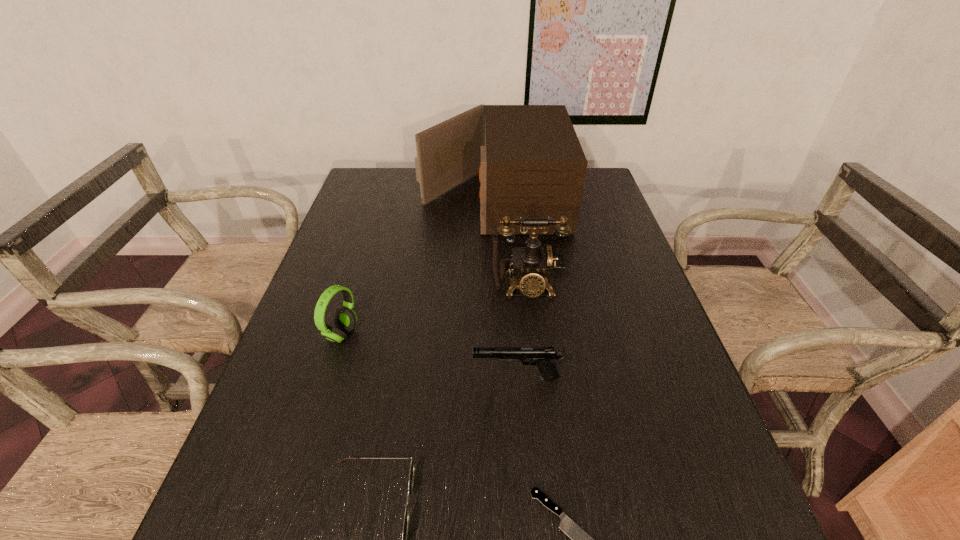
You are a GUI agent. You are given a task and a screenshot of the screen. Output one action in this format:
    pyautogui.click(x=<x>, y=<y>)
    Task: Click on the vacant space located on the front of the headset
    The height and width of the screenshot is (540, 960).
    Given the screenshot: What is the action you would take?
    pyautogui.click(x=326, y=385)

Where is `vacant area situated at the aiming end of the fourth tallest object`? The width and height of the screenshot is (960, 540). vacant area situated at the aiming end of the fourth tallest object is located at coordinates (427, 377).

What are the coordinates of `vacant space located 0.380m at the aiming end of the fourth tallest object` in the screenshot? It's located at (298, 377).

The height and width of the screenshot is (540, 960). What are the coordinates of `free space located 0.170m at the aiming end of the fourth tallest object` in the screenshot? It's located at (395, 377).

The width and height of the screenshot is (960, 540). I want to click on object present at the far edge, so click(531, 164).

This screenshot has height=540, width=960. In order to click on object that is at the left edge in this screenshot , I will do click(x=345, y=319).

You are a GUI agent. You are given a task and a screenshot of the screen. Output one action in this format:
    pyautogui.click(x=<x>, y=<y>)
    Task: Click on the object that is at the right edge
    
    Given the screenshot: What is the action you would take?
    pyautogui.click(x=531, y=164)

In order to click on object present at the far right corner in this screenshot , I will do (x=531, y=164).

At what (x,y) coordinates should I click in order to perform the action: click on free space at the left edge of the desktop. Please return your answer as a coordinate pair (x, y). The image size is (960, 540). Looking at the image, I should click on (316, 402).

This screenshot has width=960, height=540. In the image, there is a desktop. In order to click on vacant space at the right edge in this screenshot , I will do `click(634, 248)`.